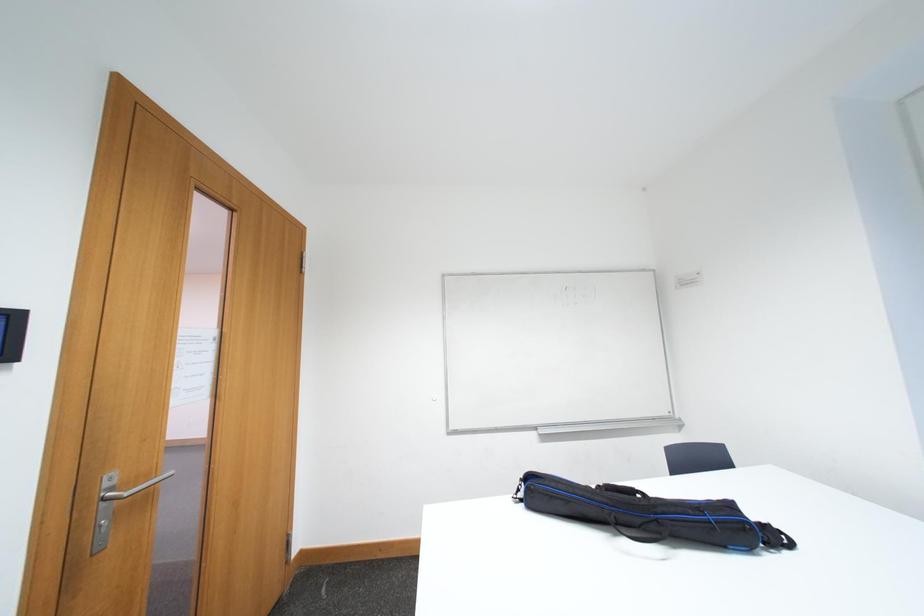
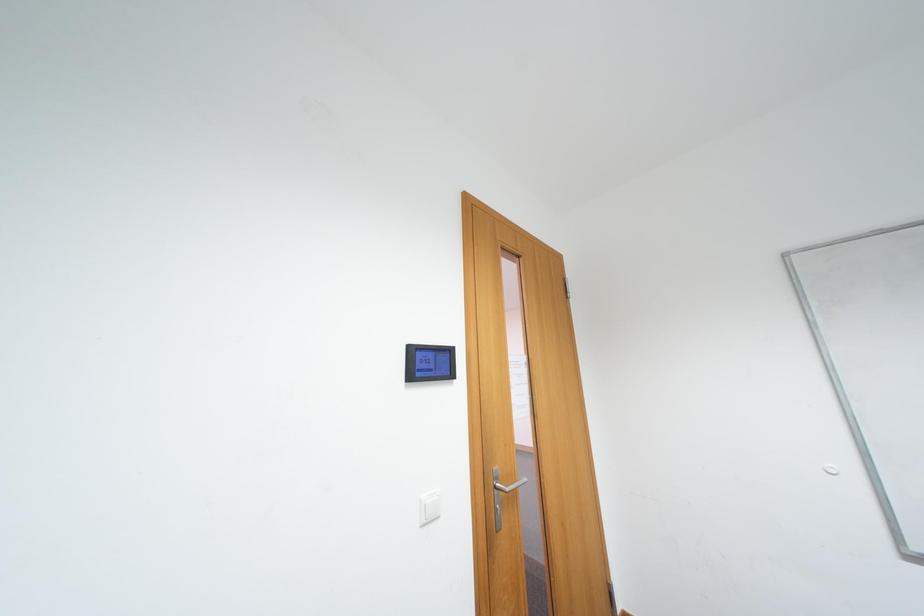
Question: Based on the continuous images, in which direction is the camera rotating? Reply with the corresponding letter.

Choices:
 (A) Left
 (B) Right
 (C) Up
 (D) Down

Answer: (A)